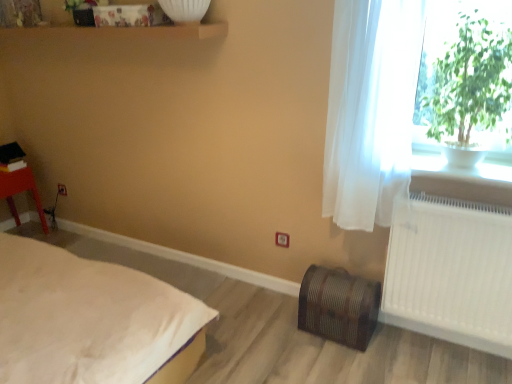
Question: Is matte plastic stool at left outside of white plastic radiator at right?

Choices:
 (A) no
 (B) yes

Answer: (B)

Question: Is matte plastic stool at left thinner than white plastic radiator at right?

Choices:
 (A) no
 (B) yes

Answer: (A)

Question: Is matte plastic stool at left far from white plastic radiator at right?

Choices:
 (A) yes
 (B) no

Answer: (A)

Question: Considering the relative sizes of matte plastic stool at left and white plastic radiator at right in the image provided, is matte plastic stool at left bigger than white plastic radiator at right?

Choices:
 (A) yes
 (B) no

Answer: (A)

Question: Does matte plastic stool at left appear on the left side of white plastic radiator at right?

Choices:
 (A) yes
 (B) no

Answer: (A)

Question: Is white soft bed at lower left wider or thinner than green leafy plant at upper right?

Choices:
 (A) thin
 (B) wide

Answer: (B)

Question: From the image's perspective, is white soft bed at lower left positioned above or below green leafy plant at upper right?

Choices:
 (A) below
 (B) above

Answer: (A)

Question: Is white soft bed at lower left situated inside green leafy plant at upper right or outside?

Choices:
 (A) outside
 (B) inside

Answer: (A)

Question: Considering their positions, is white soft bed at lower left located in front of or behind green leafy plant at upper right?

Choices:
 (A) behind
 (B) front

Answer: (B)

Question: Considering the positions of white sheer curtain at right and white ceramic pot at upper right in the image, is white sheer curtain at right wider or thinner than white ceramic pot at upper right?

Choices:
 (A) wide
 (B) thin

Answer: (B)

Question: Considering the relative positions of white sheer curtain at right and white ceramic pot at upper right in the image provided, is white sheer curtain at right to the left or to the right of white ceramic pot at upper right?

Choices:
 (A) left
 (B) right

Answer: (A)

Question: Which is correct: white sheer curtain at right is inside white ceramic pot at upper right, or outside of it?

Choices:
 (A) outside
 (B) inside

Answer: (A)

Question: From the image's perspective, is white sheer curtain at right above or below white ceramic pot at upper right?

Choices:
 (A) above
 (B) below

Answer: (A)

Question: From a real-world perspective, is white plastic radiator at right positioned above or below white soft bed at lower left?

Choices:
 (A) above
 (B) below

Answer: (A)

Question: In the image, is white plastic radiator at right positioned in front of or behind white soft bed at lower left?

Choices:
 (A) behind
 (B) front

Answer: (A)